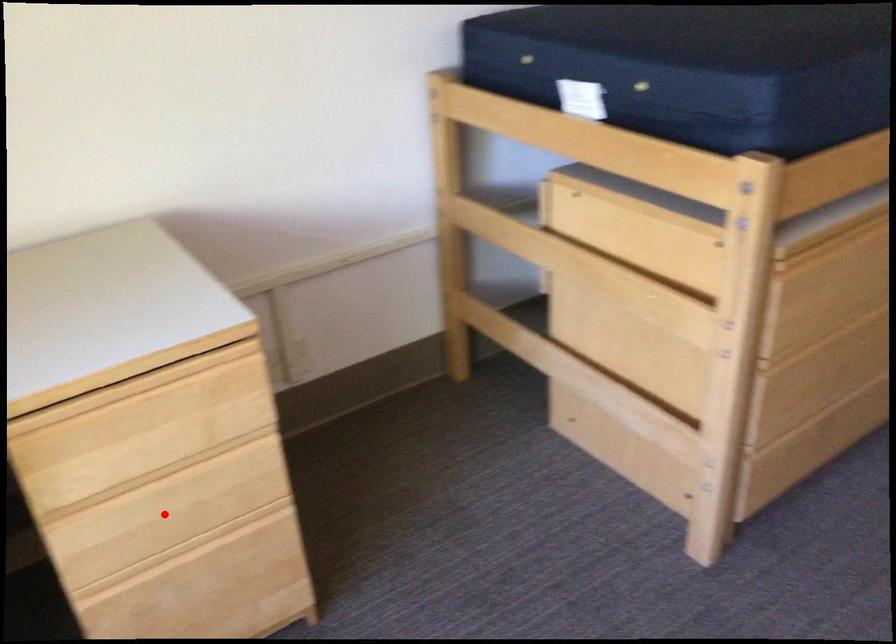
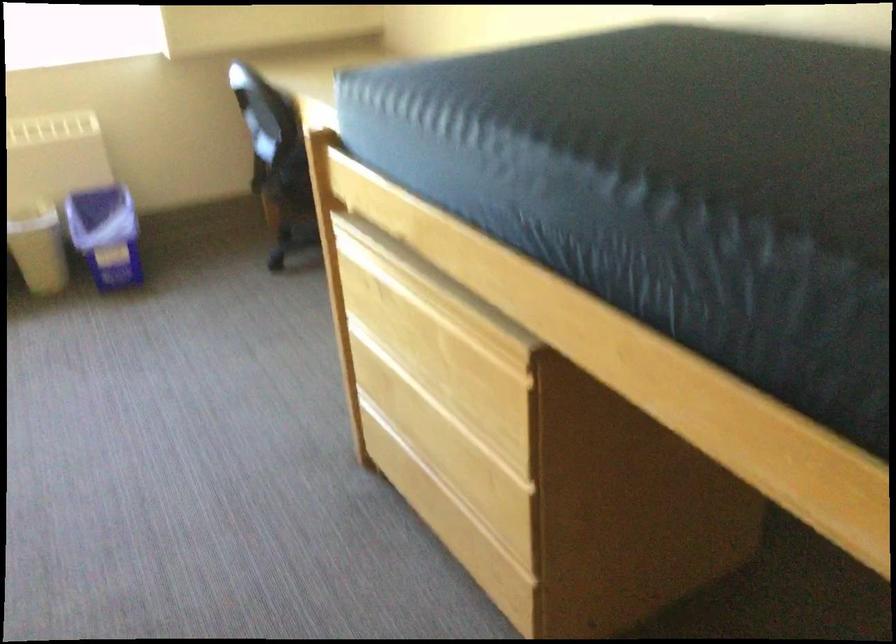
Question: I am providing you with two images of the same scene from different viewpoints. A red point is marked on the first image. Is the red point's position out of view in image 2?

Choices:
 (A) Yes
 (B) No

Answer: (A)